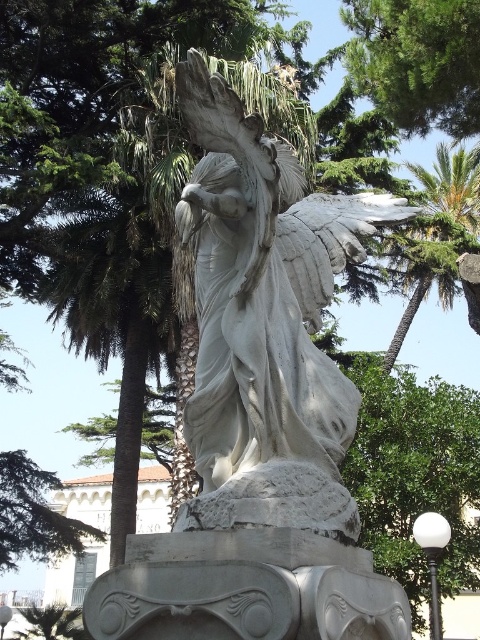
Is the position of white marble statue at center less distant than that of green leafy palm tree at upper right?

That is True.

Can you confirm if white marble statue at center is wider than green leafy palm tree at upper right?

In fact, white marble statue at center might be narrower than green leafy palm tree at upper right.

Which is behind, point (272, 502) or point (399, 241)?

Positioned behind is point (399, 241).

This screenshot has height=640, width=480. What are the coordinates of `white marble statue at center` in the screenshot? It's located at (264, 323).